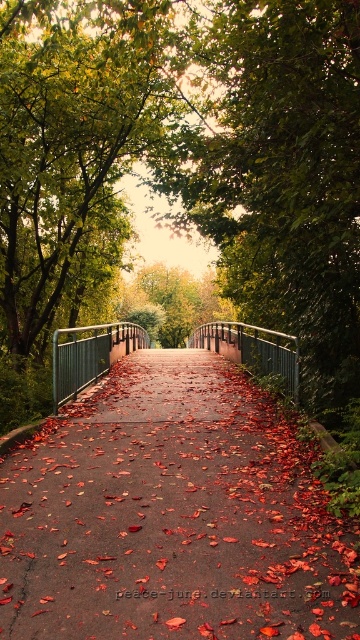
You are standing at the starting point of the pathway and want to reach the bridge at the far end. According to the coordinates provided, is the smooth asphalt path at center positioned towards the left or right side of the image?

The smooth asphalt path at center is located at coordinates point (172, 515), which places it centrally positioned in the image, neither to the left nor the right side.